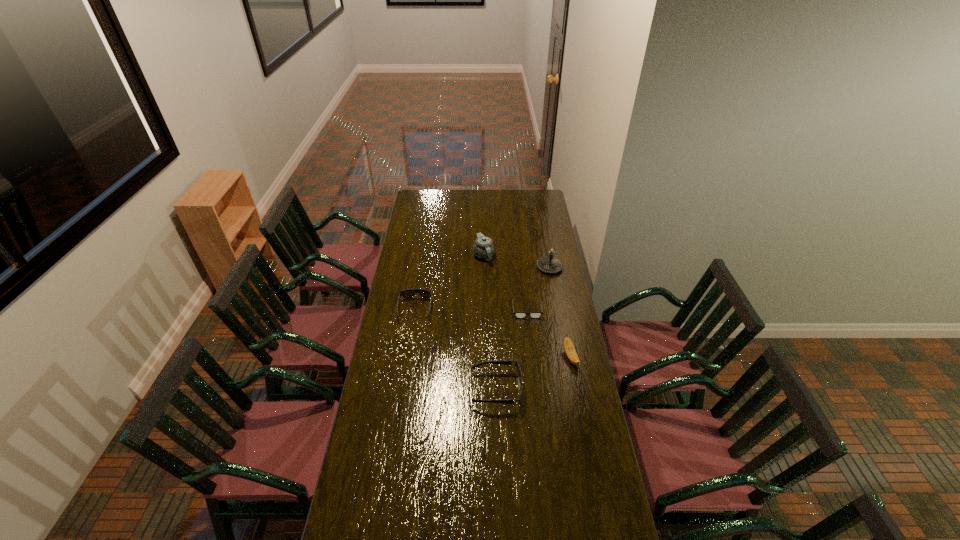
You are a GUI agent. You are given a task and a screenshot of the screen. Output one action in this format:
    pyautogui.click(x=<x>, y=<y>)
    Task: Click on the vacant space at the far edge of the desktop
    
    Given the screenshot: What is the action you would take?
    pyautogui.click(x=486, y=190)

Identify the location of vacant space at the left edge of the desktop. (420, 241).

You are a GUI agent. You are given a task and a screenshot of the screen. Output one action in this format:
    pyautogui.click(x=<x>, y=<y>)
    Task: Click on the free point at the right edge
    
    Given the screenshot: What is the action you would take?
    pyautogui.click(x=549, y=242)

The height and width of the screenshot is (540, 960). In order to click on vacant position at the far left corner of the desktop in this screenshot , I will do `click(416, 208)`.

At what (x,y) coordinates should I click in order to perform the action: click on free spot between the taller sunglasses and the chinaware. Please return your answer as a coordinate pair (x, y). Looking at the image, I should click on pyautogui.click(x=491, y=322).

Find the location of a particular element. Image resolution: width=960 pixels, height=540 pixels. vacant space in between the left sunglasses and the shortest object is located at coordinates (471, 310).

I want to click on free space between the fourth tallest object and the spectacles, so click(512, 349).

Where is `vacant space that is in between the candle and the chinaware`? The height and width of the screenshot is (540, 960). vacant space that is in between the candle and the chinaware is located at coordinates (516, 261).

This screenshot has width=960, height=540. Find the location of `blank region between the chinaware and the spectacles`. blank region between the chinaware and the spectacles is located at coordinates pyautogui.click(x=506, y=283).

This screenshot has width=960, height=540. What are the coordinates of `blank region between the chinaware and the candle` in the screenshot? It's located at (516, 261).